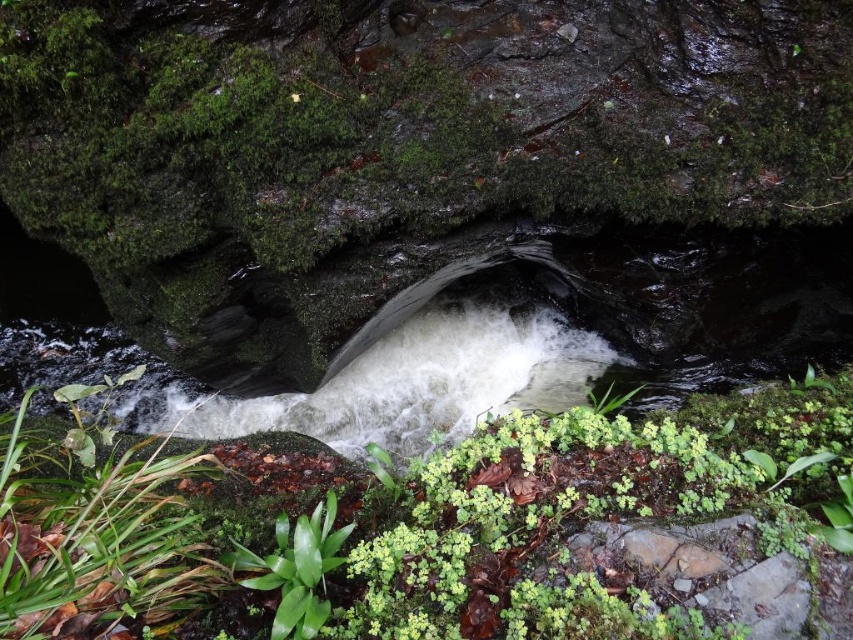
Question: Is green leafy plant at center to the left of green leafy plant at lower center from the viewer's perspective?

Choices:
 (A) no
 (B) yes

Answer: (B)

Question: Which of the following is the closest to the observer?

Choices:
 (A) (149, 476)
 (B) (271, 588)

Answer: (B)

Question: Considering the real-world distances, which object is closest to the green leafy plant at lower left?

Choices:
 (A) green leafy plant at lower center
 (B) green leafy plant at center

Answer: (A)

Question: Is green leafy plant at center below green leafy plant at lower left?

Choices:
 (A) yes
 (B) no

Answer: (B)

Question: Which object appears farthest from the camera in this image?

Choices:
 (A) green leafy plant at center
 (B) green leafy plant at lower left
 (C) green leafy plant at lower center

Answer: (C)

Question: Is green leafy plant at center positioned behind green leafy plant at lower left?

Choices:
 (A) yes
 (B) no

Answer: (A)